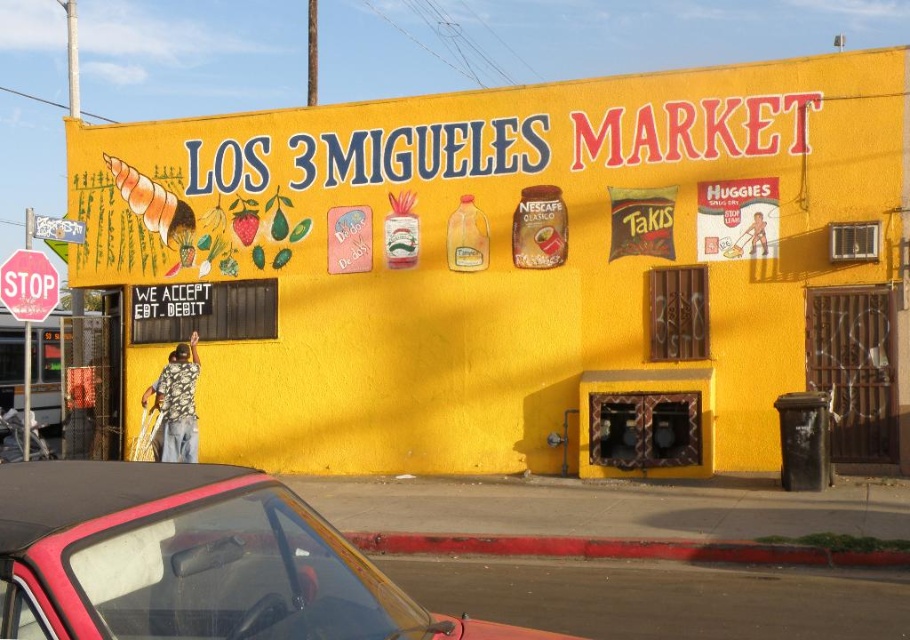
Is point (799, 125) behind point (393, 612)?

That is True.

Is yellow matte building at center to the right of shiny red convertible at lower left from the viewer's perspective?

Yes, yellow matte building at center is to the right of shiny red convertible at lower left.

Between point (595, 228) and point (119, 556), which one is positioned behind?

The point (595, 228) is more distant.

At what (x,y) coordinates should I click in order to perform the action: click on yellow matte building at center. Please return your answer as a coordinate pair (x, y). The image size is (910, 640). Looking at the image, I should click on (526, 268).

Is shiny red convertible at lower left closer to the viewer compared to red plastic stop sign at left?

Yes, shiny red convertible at lower left is closer to the viewer.

What do you see at coordinates (191, 561) in the screenshot?
I see `shiny red convertible at lower left` at bounding box center [191, 561].

Where is `shiny red convertible at lower left`? shiny red convertible at lower left is located at coordinates (191, 561).

Find the location of a particular element. The height and width of the screenshot is (640, 910). shiny red convertible at lower left is located at coordinates (191, 561).

Between yellow matte building at center and red plastic stop sign at left, which one appears on the left side from the viewer's perspective?

red plastic stop sign at left

Who is lower down, yellow matte building at center or red plastic stop sign at left?

Positioned lower is red plastic stop sign at left.

I want to click on yellow matte building at center, so click(526, 268).